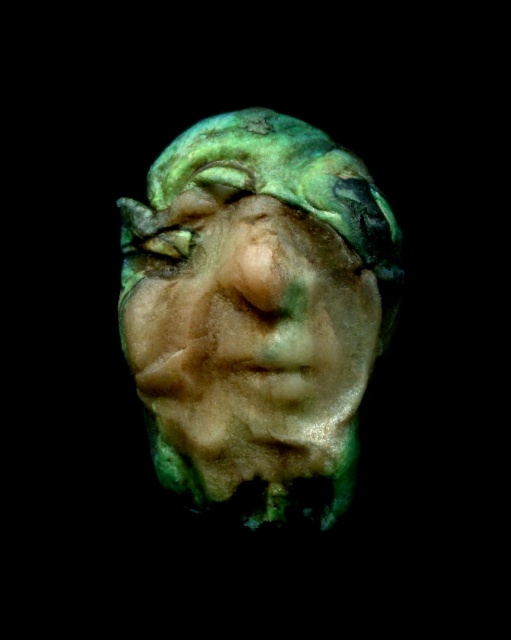
Looking at this image, does green metallic mask at center have a greater height compared to green matte eye at center?

Yes, green metallic mask at center is taller than green matte eye at center.

Does green metallic mask at center have a lesser width compared to green matte eye at center?

Incorrect, green metallic mask at center's width is not less than green matte eye at center's.

Does point (351, 387) lie behind point (145, 253)?

No, (351, 387) is in front of (145, 253).

The height and width of the screenshot is (640, 511). I want to click on green metallic mask at center, so click(x=259, y=310).